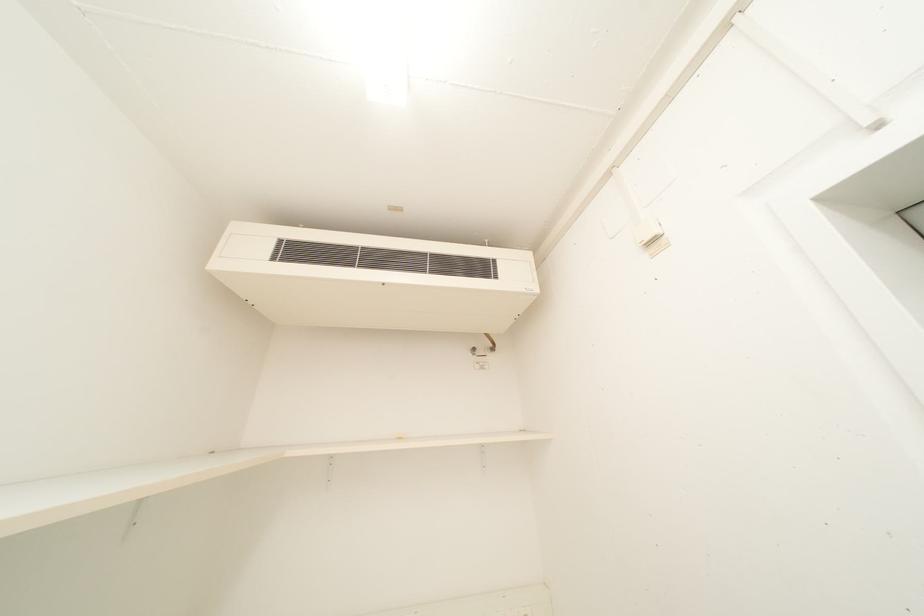
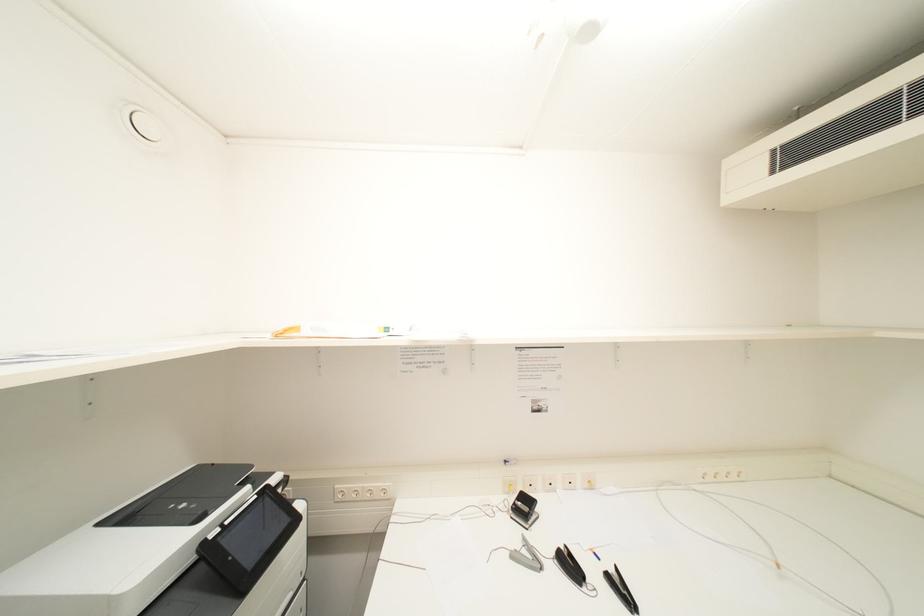
Question: The first image is from the beginning of the video and the second image is from the end. How did the camera likely rotate when shooting the video?

Choices:
 (A) Left
 (B) Right
 (C) Up
 (D) Down

Answer: (A)